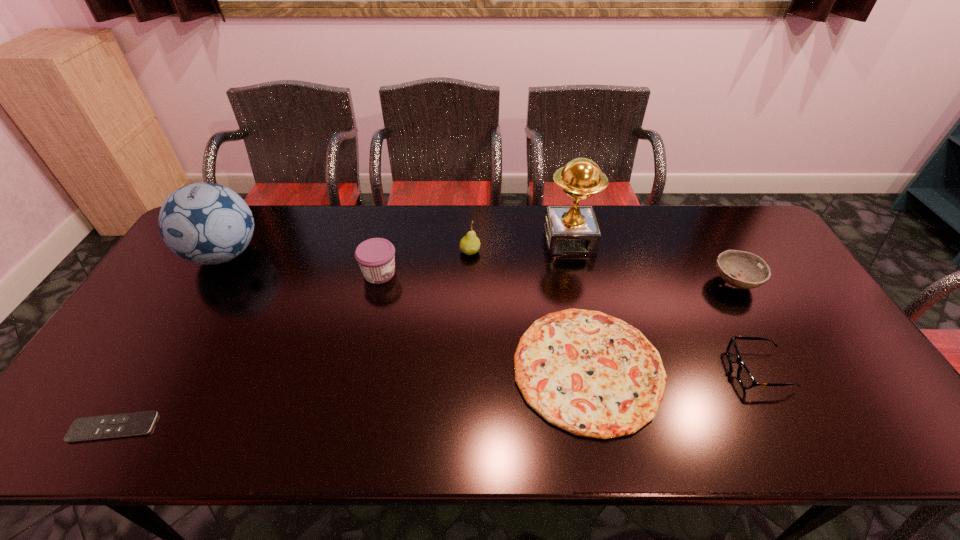
Identify the location of free space that is in between the fifth object from right to left and the pizza. (529, 310).

This screenshot has width=960, height=540. I want to click on free space between the fourth tallest object and the award, so click(x=474, y=256).

I want to click on free space between the seventh shortest object and the second shortest object, so click(406, 312).

The image size is (960, 540). Find the location of `free space between the pear and the jam`. free space between the pear and the jam is located at coordinates click(x=424, y=262).

Identify the location of object that stands as the seventh closest to the second shortest object. This screenshot has width=960, height=540. (138, 423).

Identify which object is the closest to the pear. Please provide its 2D coordinates. Your answer should be formatted as a tuple, i.e. [(x, y)], where the tuple contains the x and y coordinates of a point satisfying the conditions above.

[(376, 257)]

Image resolution: width=960 pixels, height=540 pixels. Find the location of `free region that satisfies the following two spatial constraints: 1. on the front label of the fifth tallest object; 2. on the left side of the sixth object from right to left`. free region that satisfies the following two spatial constraints: 1. on the front label of the fifth tallest object; 2. on the left side of the sixth object from right to left is located at coordinates (377, 282).

What are the coordinates of `free location that satisfies the following two spatial constraints: 1. on the front label of the second shortest object; 2. on the left side of the jam` in the screenshot? It's located at (358, 368).

Identify the location of free point that satisfies the following two spatial constraints: 1. on the back side of the bowl; 2. on the front label of the third object from left to right. (730, 273).